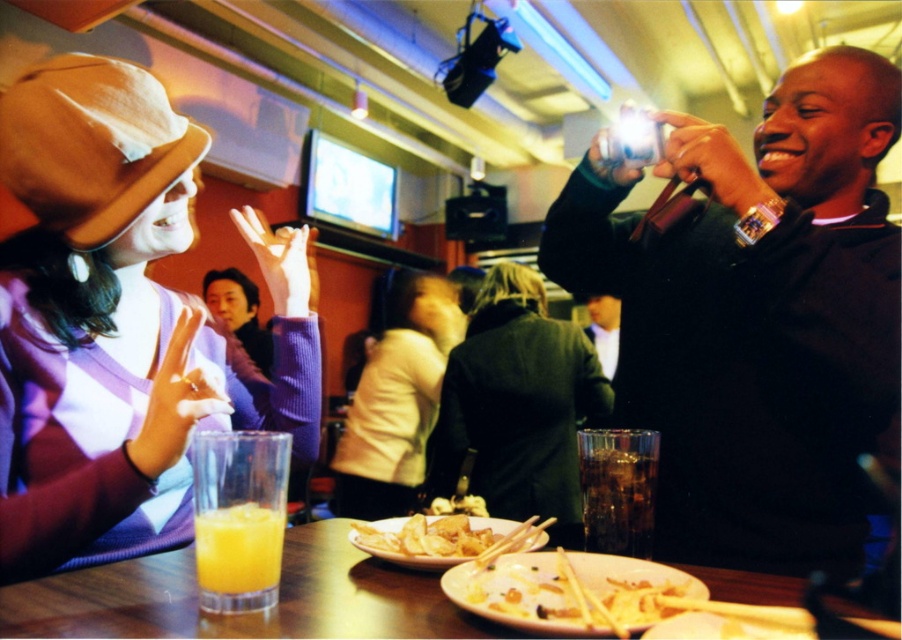
You are a server in a restaurant and need to place a new drink order on the table. The customer specified that the drink should be placed to the right of the matte purple sweater at center. Where should you place the drink relative to the translucent glass table at center?

The matte purple sweater at center is to the left of the translucent glass table at center, so placing the drink to the right of the matte purple sweater at center would mean placing it on the right side of the translucent glass table at center.

You are a photographer standing at the center of the room and want to take a photo of both point (185, 458) and point (273, 621). Which point is closer to your camera?

Point (273, 621) is closer to the camera than point (185, 458) because the description states that point (185, 458) is further away from the camera compared to point (273, 621).